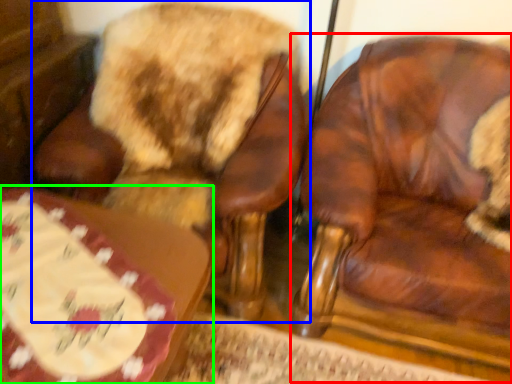
Question: Which object is the closest to the chair (highlighted by a red box)? Choose among these: chair (highlighted by a blue box) or table (highlighted by a green box).

Choices:
 (A) chair
 (B) table

Answer: (A)